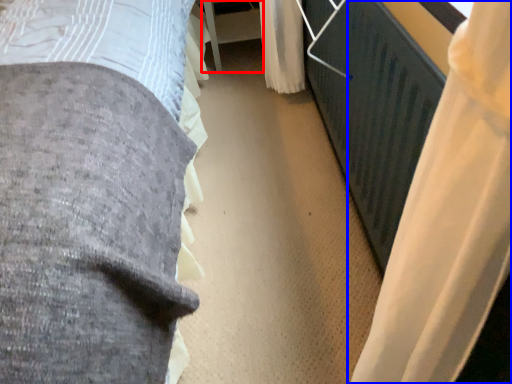
Question: Which point is closer to the camera, table (highlighted by a red box) or curtain (highlighted by a blue box)?

Choices:
 (A) table
 (B) curtain

Answer: (B)